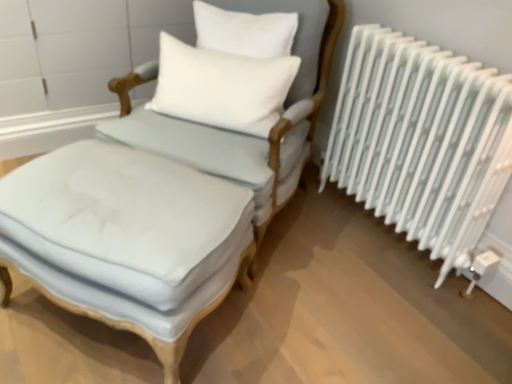
This screenshot has width=512, height=384. In order to click on vacant area situated below white metal radiator at right (from a real-world perspective) in this screenshot , I will do `click(391, 239)`.